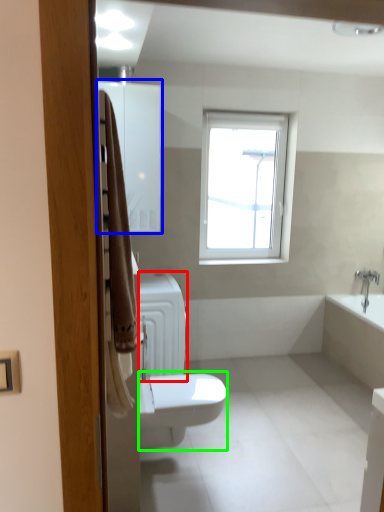
Question: Considering the real-world distances, which object is farthest from radiator (highlighted by a red box)? medicine cabinet (highlighted by a blue box) or bidet (highlighted by a green box)?

Choices:
 (A) medicine cabinet
 (B) bidet

Answer: (A)